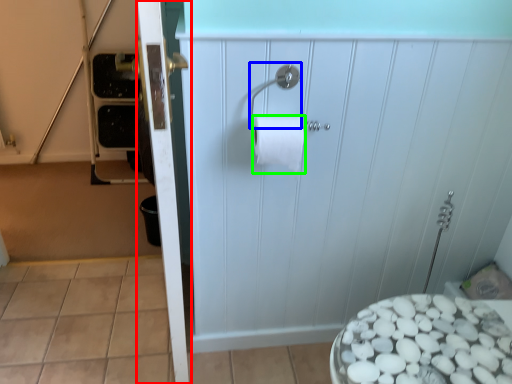
Question: Which is farther away from screen door (highlighted by a red box)? towel bar (highlighted by a blue box) or toilet paper (highlighted by a green box)?

Choices:
 (A) towel bar
 (B) toilet paper

Answer: (A)